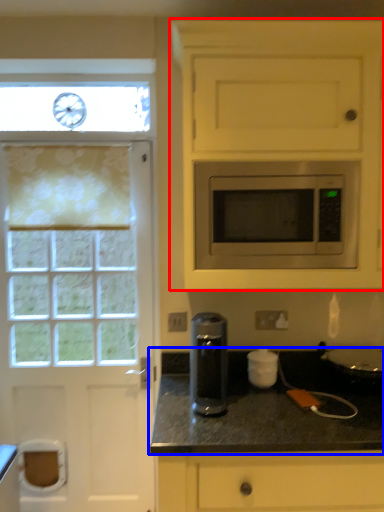
Question: Which object appears closest to the camera in this image, cabinetry (highlighted by a red box) or countertop (highlighted by a blue box)?

Choices:
 (A) cabinetry
 (B) countertop

Answer: (B)